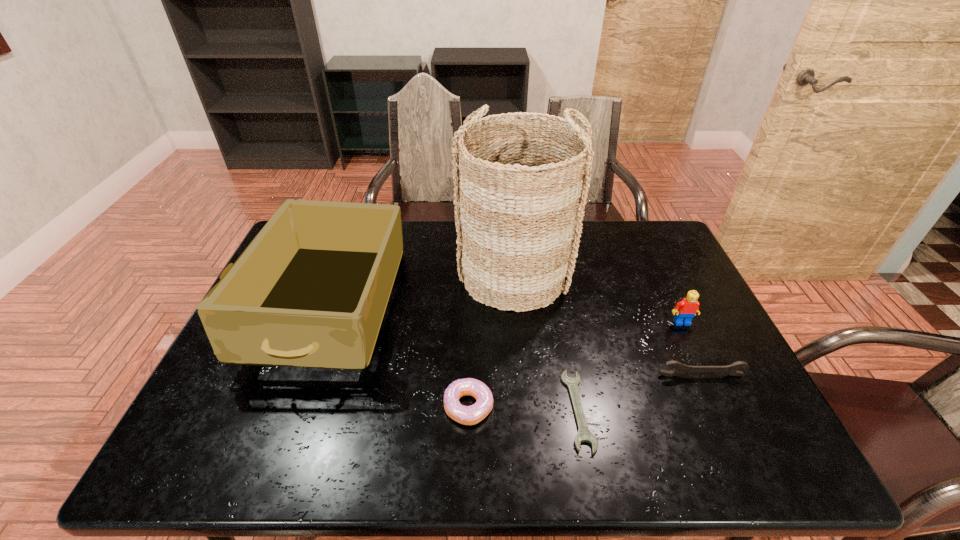
The image size is (960, 540). I want to click on the tallest object, so click(520, 196).

Locate an element on the screen. This screenshot has width=960, height=540. the leftmost object is located at coordinates (311, 290).

This screenshot has height=540, width=960. I want to click on the second tallest object, so click(311, 290).

Identify the location of the fourth shortest object. (686, 309).

Locate an element on the screen. This screenshot has width=960, height=540. the taller wrench is located at coordinates (732, 369).

Locate an element on the screen. doughnut is located at coordinates (467, 415).

Where is `the left wrench`? the left wrench is located at coordinates (584, 435).

Locate an element on the screen. This screenshot has width=960, height=540. the shorter wrench is located at coordinates (584, 435).

Find the location of `vacant space located on the back of the tallest object`. vacant space located on the back of the tallest object is located at coordinates (511, 228).

Find the location of a particular element. free location located 0.290m on the right of the box is located at coordinates (494, 309).